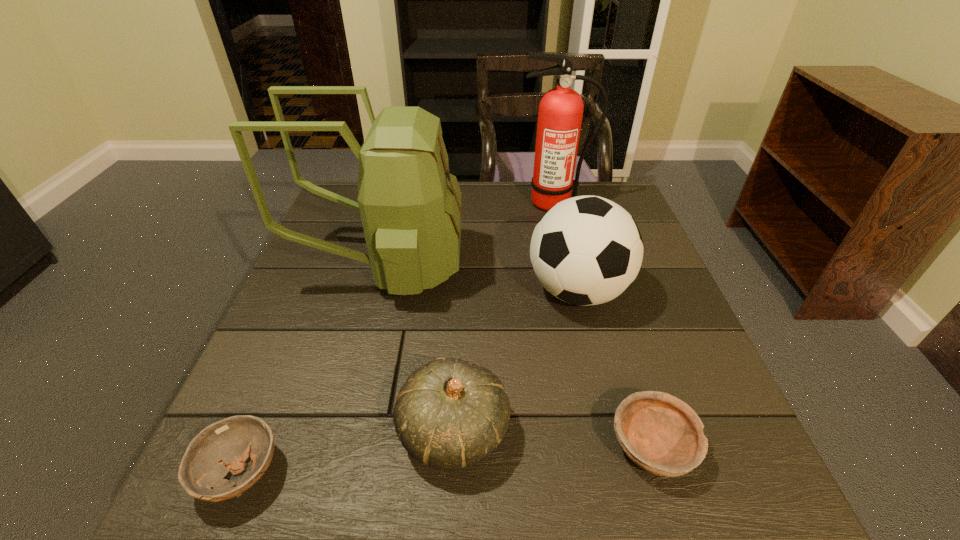
Locate an element on the screen. Image resolution: width=960 pixels, height=540 pixels. the farthest object is located at coordinates (560, 114).

Identify the location of backpack. Image resolution: width=960 pixels, height=540 pixels. (410, 205).

The image size is (960, 540). Identify the location of the fourth shortest object. [x=587, y=250].

Identify the location of the fourth tallest object. The image size is (960, 540). (450, 414).

Where is `the left bowl`? The height and width of the screenshot is (540, 960). the left bowl is located at coordinates (224, 446).

Find the location of a particular element. The width and height of the screenshot is (960, 540). the right bowl is located at coordinates (660, 433).

The image size is (960, 540). Find the location of `vacant space located on the handle side of the farthest object`. vacant space located on the handle side of the farthest object is located at coordinates (569, 266).

Where is `vacant point located 0.250m on the front pocket of the backpack`? The image size is (960, 540). vacant point located 0.250m on the front pocket of the backpack is located at coordinates (561, 267).

Find the location of a particular element. This screenshot has width=960, height=540. free location located on the left of the fourth shortest object is located at coordinates (381, 291).

Identify the location of blank area located on the back of the third shortest object. (457, 362).